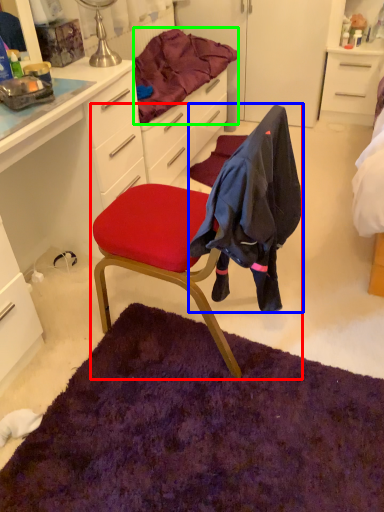
Question: Estimate the real-world distances between objects in this image. Which object is closer to chair (highlighted by a red box), clothing (highlighted by a blue box) or bedding (highlighted by a green box)?

Choices:
 (A) clothing
 (B) bedding

Answer: (A)